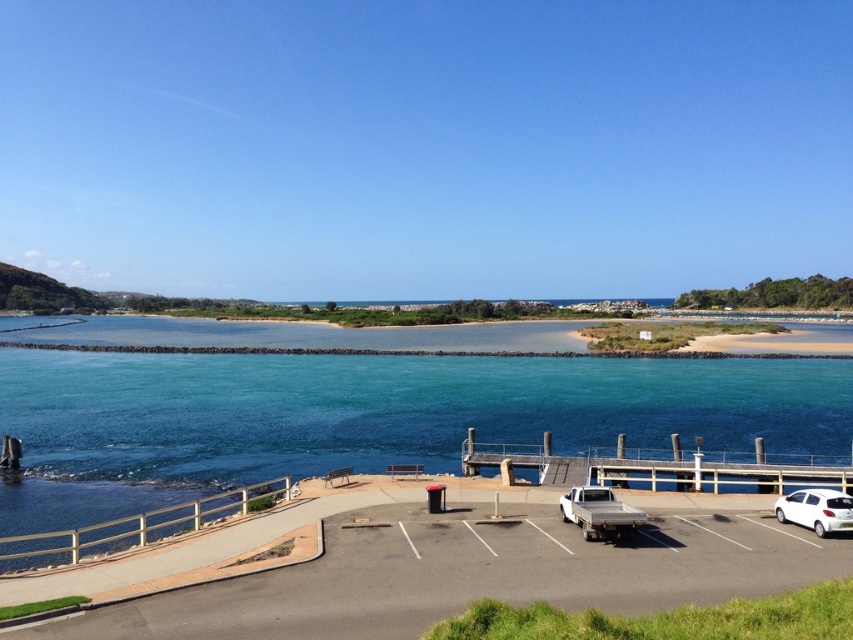
You are standing at the white car in the parking area and want to reach the wooden dock at center. Which direction should you head to? The wooden dock at center is represented by point [663,467]. The white car is at the bottom left of the image. The parking area is at the bottom of the image. The direction options are north, south, east, or west.

You should head north towards the wooden dock at center. Since the white car is at the bottom left of the image, heading north would move you upward in the image towards the dock located at point [663,467].

In the scene shown: You are standing on the wooden dock at center and want to park your car on the black asphalt parking lot at lower center. Which direction should you drive to reach the parking lot?

Since the black asphalt parking lot at lower center is positioned on the left side of the wooden dock at center, you should drive to the left to reach the parking lot.

You are a delivery driver who needs to park your vehicle in the black asphalt parking lot at lower center. However, there is a white matte truck at lower right blocking the entrance. Based on their positions, can you drive around the truck to access the parking lot?

The black asphalt parking lot at lower center is located below the white matte truck at lower right. Since the parking lot is positioned below the truck, you can drive around the truck by moving downward from its position to access the parking lot.